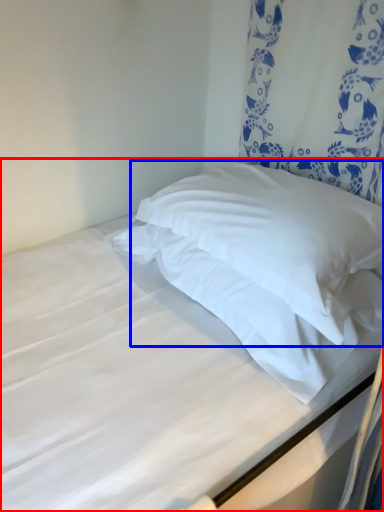
Question: Which object appears closest to the camera in this image, bed (highlighted by a red box) or pillow (highlighted by a blue box)?

Choices:
 (A) bed
 (B) pillow

Answer: (A)